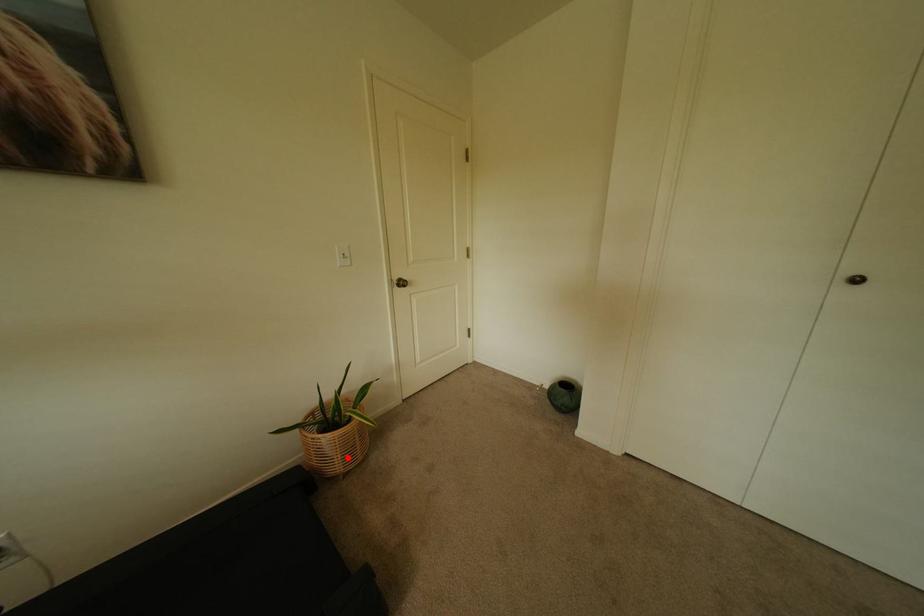
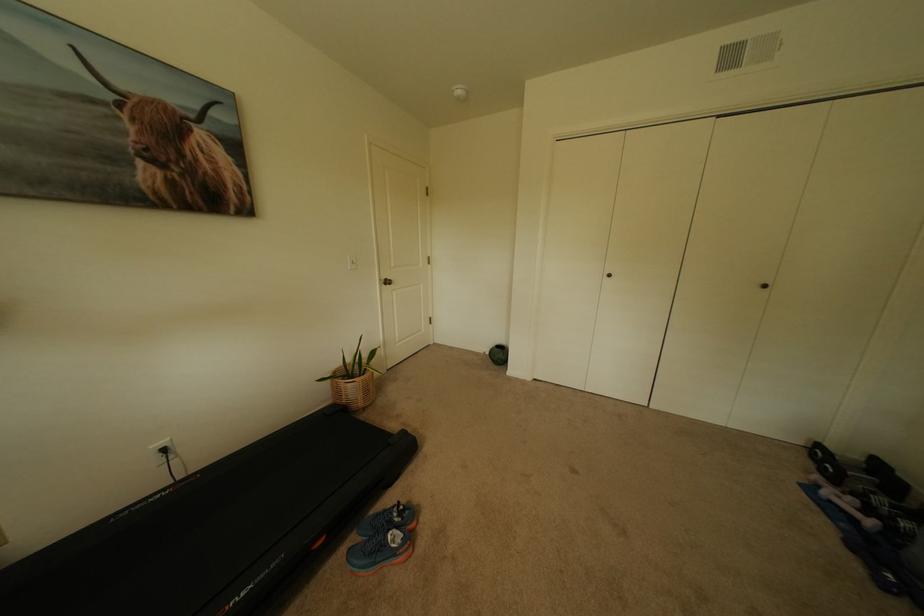
Question: I am providing you with two images of the same scene from different viewpoints. Image1 has a red point marked. In image2, the corresponding 3D location appears at what relative position? Reply with the corresponding letter.

Choices:
 (A) Closer
 (B) Farther

Answer: (A)